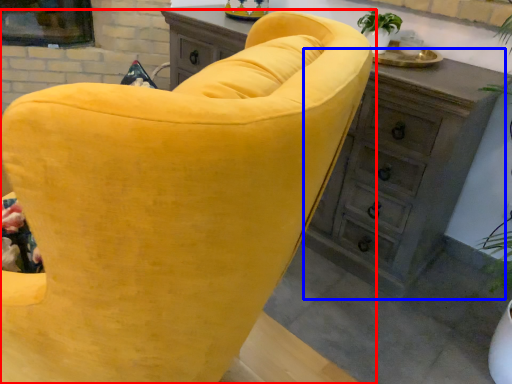
Question: Among these objects, which one is farthest to the camera, chair (highlighted by a red box) or dresser (highlighted by a blue box)?

Choices:
 (A) chair
 (B) dresser

Answer: (B)